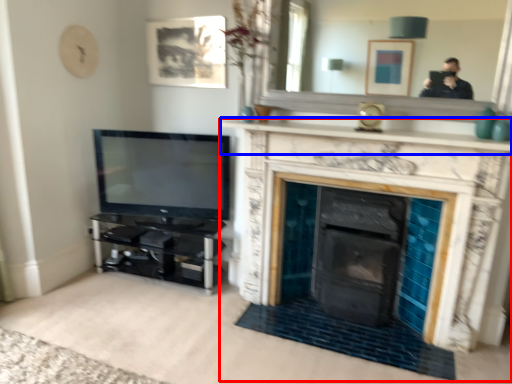
Question: Which object appears farthest to the camera in this image, fireplace (highlighted by a red box) or mantle (highlighted by a blue box)?

Choices:
 (A) fireplace
 (B) mantle

Answer: (B)